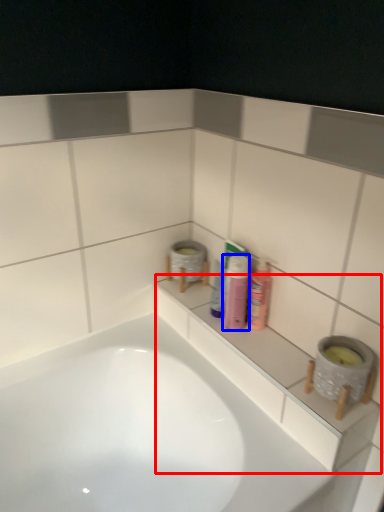
Question: Which of the following is the farthest to the observer, ledge (highlighted by a red box) or toiletry (highlighted by a blue box)?

Choices:
 (A) ledge
 (B) toiletry

Answer: (B)